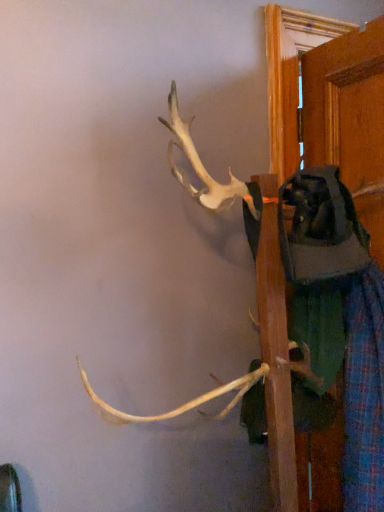
Locate an element on the screen. wooden door at right is located at coordinates (x=346, y=104).

Describe the element at coordinates (346, 104) in the screenshot. I see `wooden door at right` at that location.

Measure the distance between point (x=381, y=254) and camera.

The distance of point (x=381, y=254) from camera is 3.42 feet.

Find the location of a particular element. plaid fabric pants at right is located at coordinates (337, 323).

Describe the element at coordinates (337, 323) in the screenshot. This screenshot has width=384, height=512. I see `plaid fabric pants at right` at that location.

I want to click on wooden door at right, so click(346, 104).

Would you say plaid fabric pants at right is to the left or to the right of wooden door at right in the picture?

plaid fabric pants at right is to the left of wooden door at right.

Does plaid fabric pants at right come behind wooden door at right?

No, plaid fabric pants at right is in front of wooden door at right.

Which is less distant, (x=258, y=230) or (x=360, y=279)?

Point (x=258, y=230)

From the image's perspective, does plaid fabric pants at right appear higher than wooden door at right?

No, from the image's perspective, plaid fabric pants at right is not above wooden door at right.

From a real-world perspective, is plaid fabric pants at right located beneath wooden door at right?

Yes, from a real-world perspective, plaid fabric pants at right is below wooden door at right.

Which of these two, plaid fabric pants at right or wooden door at right, is thinner?

With smaller width is wooden door at right.

Considering the relative sizes of plaid fabric pants at right and wooden door at right in the image provided, is plaid fabric pants at right shorter than wooden door at right?

Yes, plaid fabric pants at right is shorter than wooden door at right.

Based on their sizes in the image, would you say plaid fabric pants at right is bigger or smaller than wooden door at right?

Considering their sizes, plaid fabric pants at right takes up more space than wooden door at right.

Could wooden door at right be considered to be inside plaid fabric pants at right?

No, wooden door at right is not inside plaid fabric pants at right.

Is plaid fabric pants at right not near wooden door at right?

No, plaid fabric pants at right is not far from wooden door at right.

Is plaid fabric pants at right aimed at wooden door at right?

No, plaid fabric pants at right is not aimed at wooden door at right.

Image resolution: width=384 pixels, height=512 pixels. Identify the location of clothing in front of the wooden door at right. (337, 323).

Which is more to the right, wooden door at right or plaid fabric pants at right?

wooden door at right is more to the right.

Which is behind, wooden door at right or plaid fabric pants at right?

wooden door at right is more distant.

Does point (357, 315) come behind point (295, 404)?

That is False.

From the image's perspective, which is below, wooden door at right or plaid fabric pants at right?

From the image's view, plaid fabric pants at right is below.

From a real-world perspective, which is physically above, wooden door at right or plaid fabric pants at right?

wooden door at right is physically above.

Which of these two, wooden door at right or plaid fabric pants at right, is thinner?

wooden door at right is thinner.

Who is shorter, wooden door at right or plaid fabric pants at right?

plaid fabric pants at right is shorter.

Is wooden door at right bigger than plaid fabric pants at right?

Incorrect, wooden door at right is not larger than plaid fabric pants at right.

Choose the correct answer: Is wooden door at right inside plaid fabric pants at right or outside it?

The correct answer is: outside.

Are wooden door at right and plaid fabric pants at right located far from each other?

No.

Is wooden door at right looking in the opposite direction of plaid fabric pants at right?

No, plaid fabric pants at right is not at the back of wooden door at right.

Based on the photo, what's the angular difference between wooden door at right and plaid fabric pants at right's facing directions?

There is a 0.000355-degree angle between the facing directions of wooden door at right and plaid fabric pants at right.

Identify the location of door that is on the right side of plaid fabric pants at right. (346, 104).

Find the location of a particular element. Image resolution: width=384 pixels, height=512 pixels. door behind the plaid fabric pants at right is located at coordinates (346, 104).

The width and height of the screenshot is (384, 512). I want to click on clothing on the left of the wooden door at right, so click(x=337, y=323).